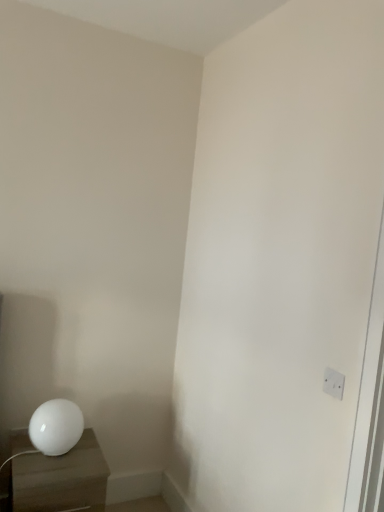
This screenshot has height=512, width=384. Find the location of `free location to the right of white glossy sphere at lower left`. free location to the right of white glossy sphere at lower left is located at coordinates (88, 456).